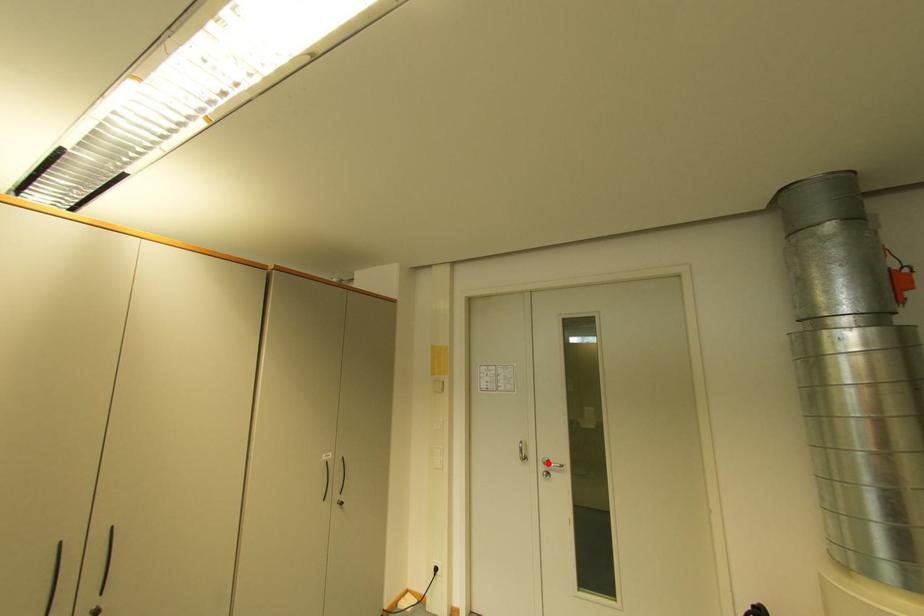
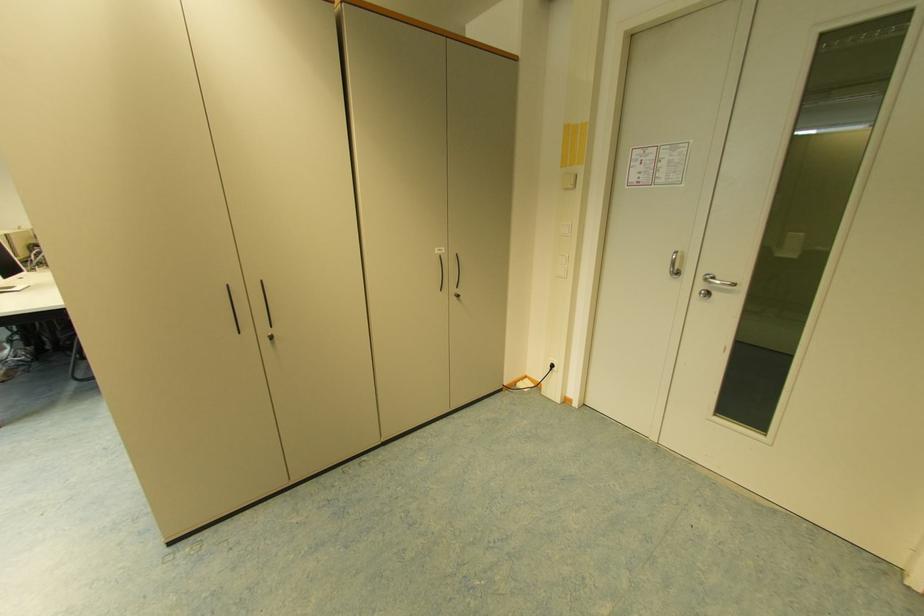
Question: I am providing you with two images of the same scene from different viewpoints. In image1, a red point is highlighted. Considering the same 3D point in image2, which of the following is correct?

Choices:
 (A) It is closer
 (B) It is farther

Answer: (A)